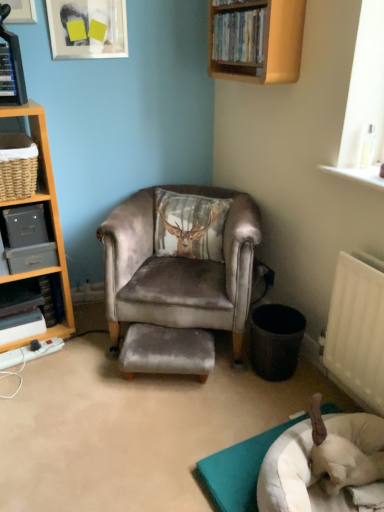
The height and width of the screenshot is (512, 384). What are the coordinates of `vacant area located to the right-hand side of velvet grey stool at center` in the screenshot? It's located at (241, 382).